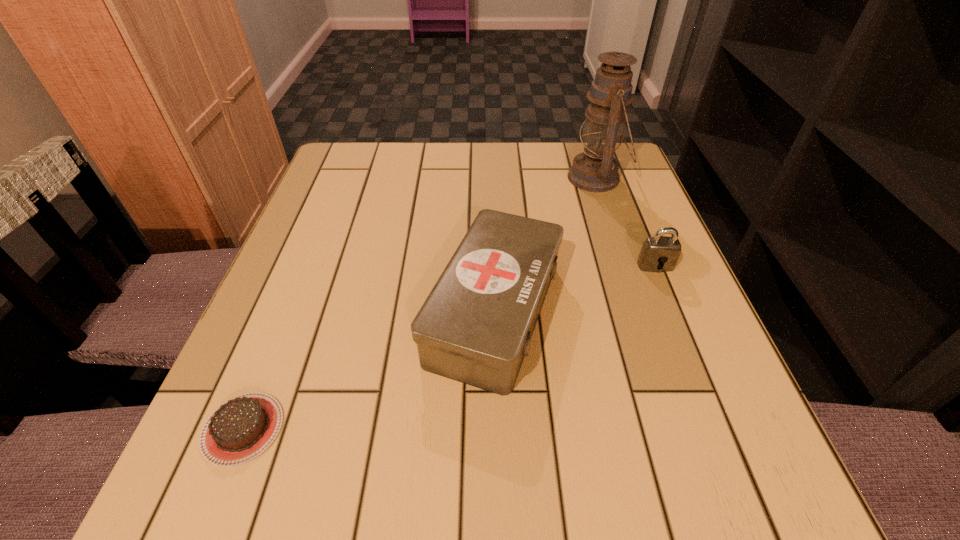
I want to click on object at the far edge, so click(x=595, y=170).

What are the coordinates of `object at the near edge` in the screenshot? It's located at (239, 430).

This screenshot has width=960, height=540. In order to click on object located at the left edge in this screenshot , I will do `click(239, 430)`.

I want to click on oil lamp situated at the right edge, so click(595, 170).

You are a GUI agent. You are given a task and a screenshot of the screen. Output one action in this format:
    pyautogui.click(x=<x>, y=<y>)
    Task: Click on the padlock located in the right edge section of the desktop
    This screenshot has width=960, height=540.
    Given the screenshot: What is the action you would take?
    pyautogui.click(x=660, y=253)

Locate an element on the screen. object that is positioned at the near left corner is located at coordinates (239, 430).

Find the location of a particular element. The image size is (960, 540). object present at the far right corner is located at coordinates (595, 170).

This screenshot has height=540, width=960. In order to click on free space at the far edge of the desktop in this screenshot , I will do `click(564, 151)`.

The image size is (960, 540). Find the location of `vacant space at the near edge`. vacant space at the near edge is located at coordinates (502, 455).

You are a GUI agent. You are given a task and a screenshot of the screen. Output one action in this format:
    pyautogui.click(x=<x>, y=<y>)
    Task: Click on the vacant space at the left edge of the desktop
    The width and height of the screenshot is (960, 540).
    Given the screenshot: What is the action you would take?
    pyautogui.click(x=357, y=217)